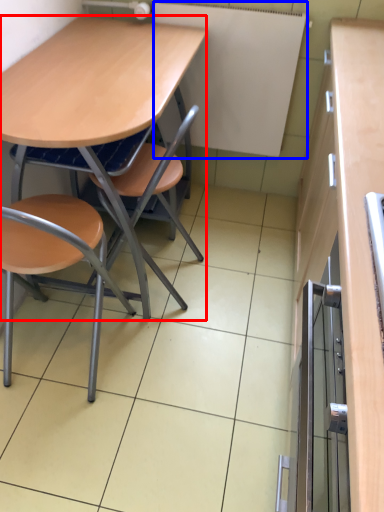
Question: Which object appears closest to the camera in this image, desk (highlighted by a red box) or bulletin board (highlighted by a blue box)?

Choices:
 (A) desk
 (B) bulletin board

Answer: (A)